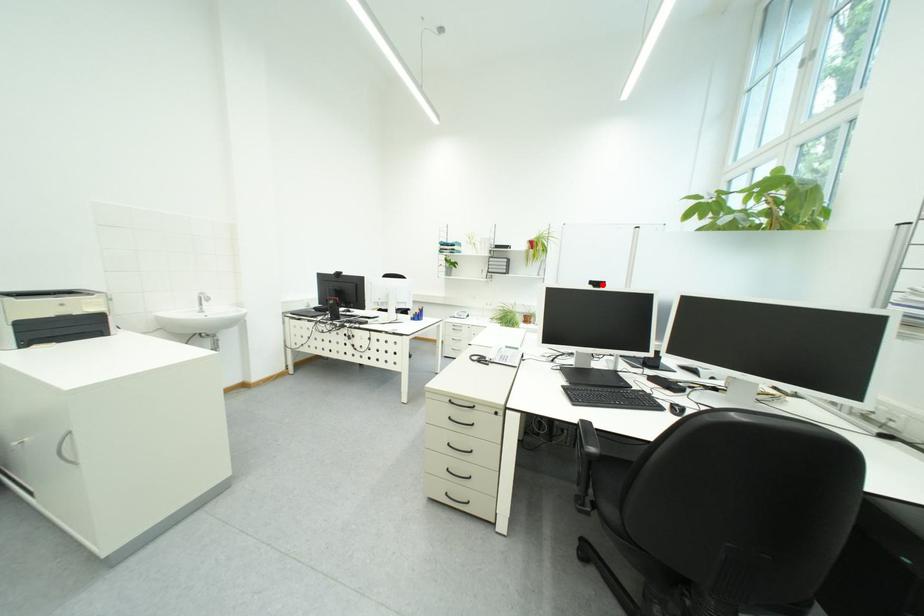
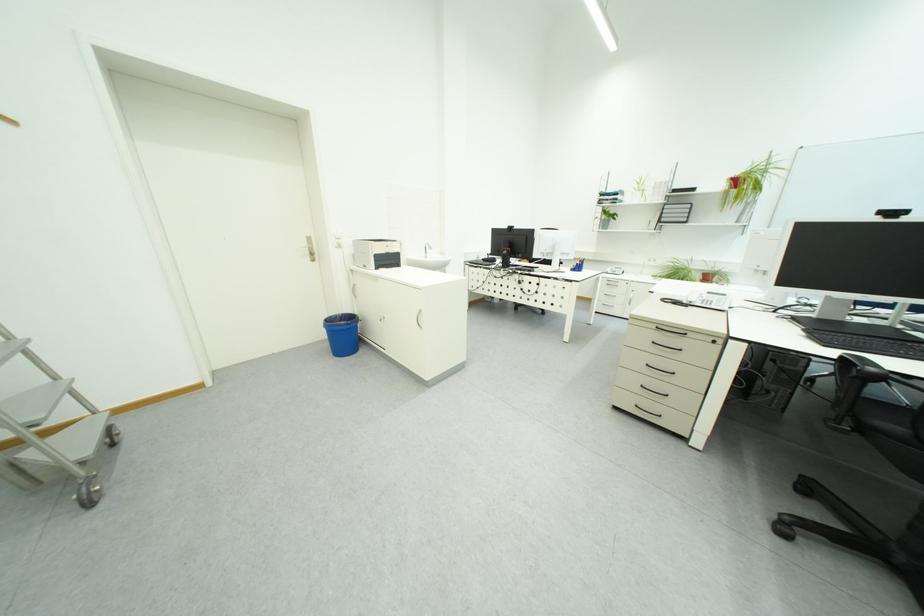
Where in the second image is the point corresponding to the highlighted location from the first image?

(893, 215)